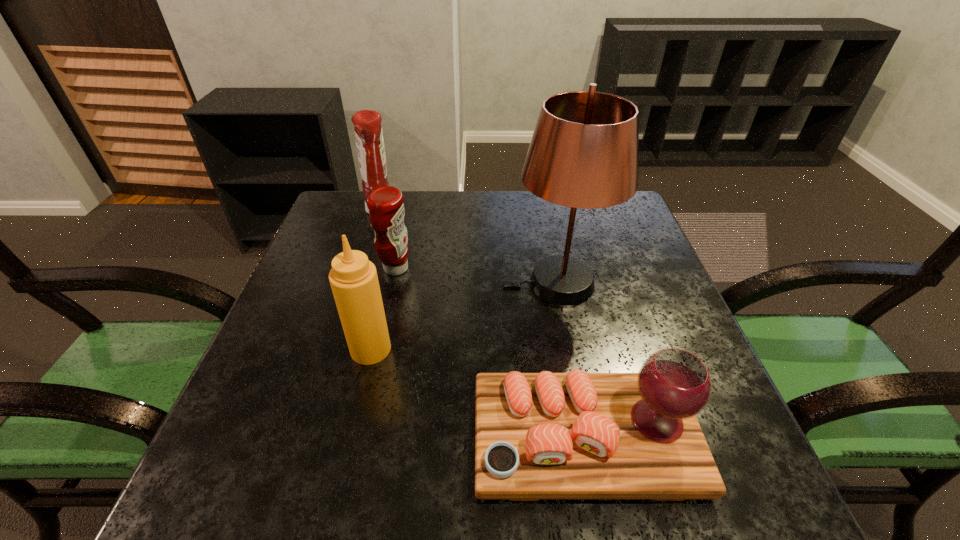
Find the location of a particular element. The width and height of the screenshot is (960, 540). vacant space situated on the right of the second nearest condiment is located at coordinates 520,268.

Where is `blank space located on the back of the platter`? This screenshot has height=540, width=960. blank space located on the back of the platter is located at coordinates (569, 361).

Locate an element on the screen. This screenshot has height=540, width=960. object positioned at the far edge is located at coordinates (368, 131).

The width and height of the screenshot is (960, 540). Identify the location of object at the near edge. (576, 435).

Locate an element on the screen. Image resolution: width=960 pixels, height=540 pixels. object that is at the left edge is located at coordinates click(x=368, y=131).

Image resolution: width=960 pixels, height=540 pixels. I want to click on lampshade that is at the right edge, so click(x=584, y=153).

Locate an element on the screen. The image size is (960, 540). platter located in the right edge section of the desktop is located at coordinates (576, 435).

You are a GUI agent. You are given a task and a screenshot of the screen. Output one action in this format:
    pyautogui.click(x=<x>, y=<y>)
    Task: Click on the object located at the far left corner
    The height and width of the screenshot is (540, 960).
    Given the screenshot: What is the action you would take?
    pyautogui.click(x=368, y=131)

Locate an element on the screen. The width and height of the screenshot is (960, 540). object at the near right corner is located at coordinates (576, 435).

Find the location of a particular element. vacant area at the far edge of the desktop is located at coordinates (433, 204).